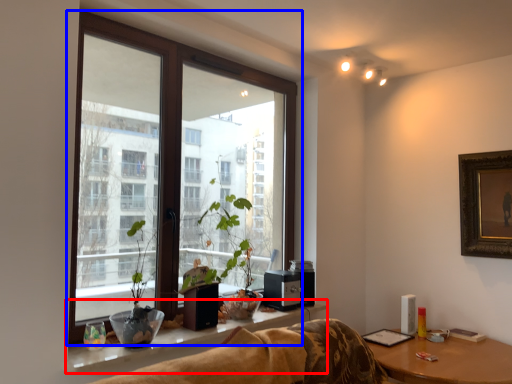
Question: Which of the following is the farthest to the observer, window sill (highlighted by a red box) or window (highlighted by a blue box)?

Choices:
 (A) window sill
 (B) window

Answer: (B)